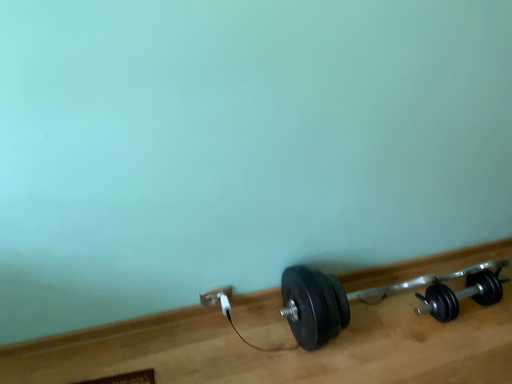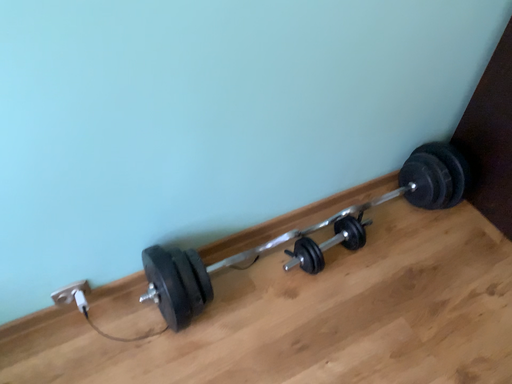
Question: Which way did the camera rotate in the video?

Choices:
 (A) rotated left
 (B) rotated right

Answer: (B)